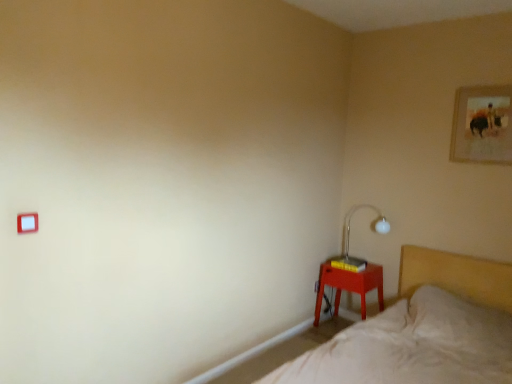
Question: Can you see gold-framed picture at upper right touching white plastic light switch at upper left?

Choices:
 (A) no
 (B) yes

Answer: (A)

Question: Is gold-framed picture at upper right to the left of white plastic light switch at upper left from the viewer's perspective?

Choices:
 (A) yes
 (B) no

Answer: (B)

Question: Considering the relative sizes of gold-framed picture at upper right and white plastic light switch at upper left in the image provided, is gold-framed picture at upper right shorter than white plastic light switch at upper left?

Choices:
 (A) yes
 (B) no

Answer: (B)

Question: Is gold-framed picture at upper right to the right of white plastic light switch at upper left from the viewer's perspective?

Choices:
 (A) no
 (B) yes

Answer: (B)

Question: Does gold-framed picture at upper right have a lesser width compared to white plastic light switch at upper left?

Choices:
 (A) yes
 (B) no

Answer: (B)

Question: From the image's perspective, is gold-framed picture at upper right beneath white plastic light switch at upper left?

Choices:
 (A) yes
 (B) no

Answer: (B)

Question: Is gold-framed picture at upper right positioned with its back to white glass table lamp at right?

Choices:
 (A) yes
 (B) no

Answer: (B)

Question: Considering the relative sizes of gold-framed picture at upper right and white glass table lamp at right in the image provided, is gold-framed picture at upper right bigger than white glass table lamp at right?

Choices:
 (A) yes
 (B) no

Answer: (B)

Question: Is gold-framed picture at upper right not close to white glass table lamp at right?

Choices:
 (A) no
 (B) yes

Answer: (B)

Question: Considering the relative sizes of gold-framed picture at upper right and white glass table lamp at right in the image provided, is gold-framed picture at upper right smaller than white glass table lamp at right?

Choices:
 (A) yes
 (B) no

Answer: (A)

Question: Can you confirm if gold-framed picture at upper right is wider than white glass table lamp at right?

Choices:
 (A) yes
 (B) no

Answer: (B)

Question: From the image's perspective, does gold-framed picture at upper right appear higher than white glass table lamp at right?

Choices:
 (A) no
 (B) yes

Answer: (B)

Question: Is white plastic light switch at upper left closer to camera compared to gold-framed picture at upper right?

Choices:
 (A) yes
 (B) no

Answer: (A)